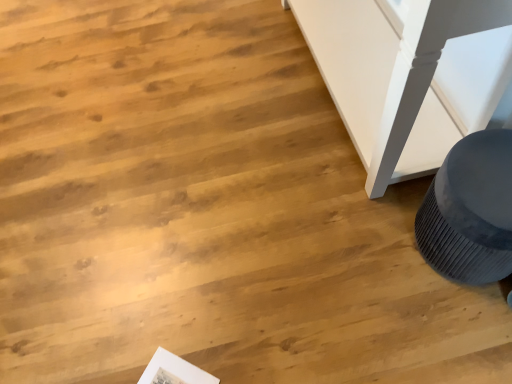
I want to click on vacant space that is to the left of matte gray speaker at lower right, so click(370, 259).